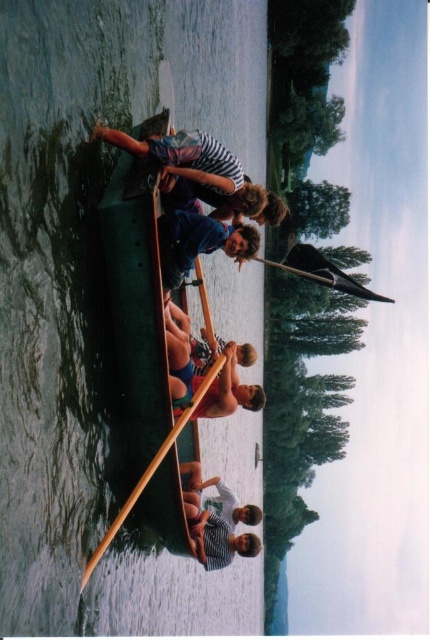
Question: Among these points, which one is farthest from the camera?

Choices:
 (A) (239, 248)
 (B) (224, 518)
 (C) (390, 300)

Answer: (C)

Question: Which of these objects is positioned farthest from the black matte paddle at upper center?

Choices:
 (A) striped fabric person at center
 (B) blue denim shorts at center
 (C) blue cotton shirt at center

Answer: (A)

Question: Observing the image, what is the correct spatial positioning of striped fabric person at upper center in reference to blue denim shorts at center?

Choices:
 (A) left
 (B) right

Answer: (A)

Question: Is striped fabric person at upper center behind striped fabric person at center?

Choices:
 (A) yes
 (B) no

Answer: (B)

Question: Is green wood boat at center bigger than blue denim shorts at center?

Choices:
 (A) yes
 (B) no

Answer: (A)

Question: Estimate the real-world distances between objects in this image. Which object is closer to the striped fabric person at upper center?

Choices:
 (A) striped fabric person at center
 (B) green wood boat at center
 (C) blue denim shorts at center
 (D) black matte paddle at upper center

Answer: (C)